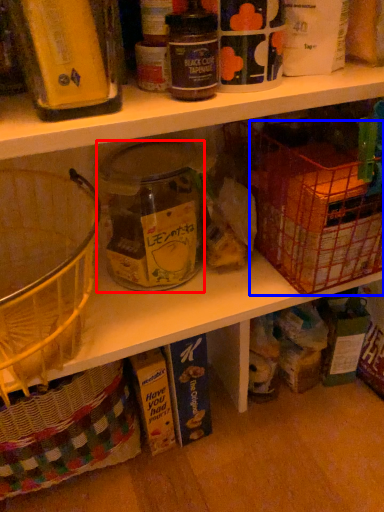
Question: Which of the following is the closest to the observer, glass jar (highlighted by a red box) or basket (highlighted by a blue box)?

Choices:
 (A) glass jar
 (B) basket

Answer: (B)